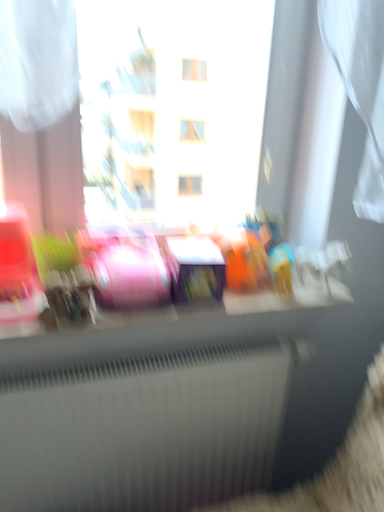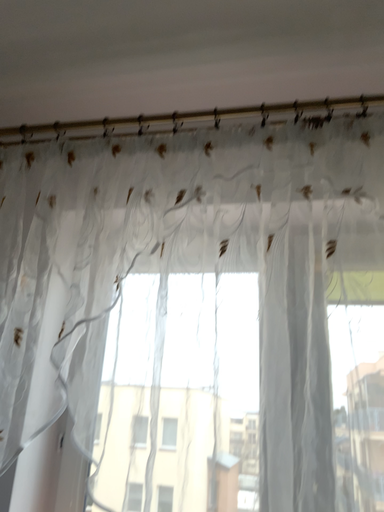
Question: Which way did the camera rotate in the video?

Choices:
 (A) rotated downward
 (B) rotated upward

Answer: (B)